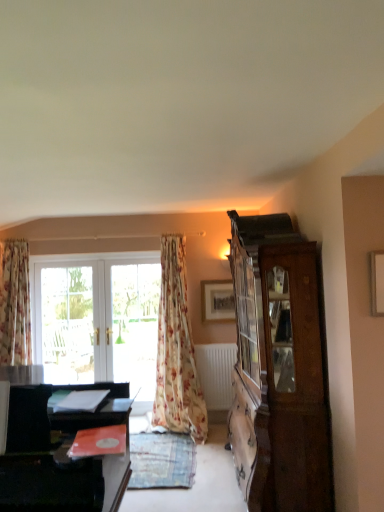
This screenshot has width=384, height=512. What do you see at coordinates (217, 301) in the screenshot? I see `wooden picture frame at upper center` at bounding box center [217, 301].

Measure the distance between point (310, 296) and camera.

The distance of point (310, 296) from camera is 8.84 feet.

This screenshot has height=512, width=384. What do you see at coordinates (54, 457) in the screenshot?
I see `black glossy desk at lower left` at bounding box center [54, 457].

Measure the distance between point (186, 381) and camera.

Point (186, 381) and camera are 15.04 feet apart.

Describe the element at coordinates (68, 321) in the screenshot. I see `clear glass window at center, marked as the first window in a left-to-right arrangement` at that location.

Where is `white glossy screen door at center`? The width and height of the screenshot is (384, 512). white glossy screen door at center is located at coordinates (135, 325).

Is white glass door at center, which is counted as the 1th window, starting from the right, wider than white glossy screen door at center?

Incorrect, the width of white glass door at center, which is counted as the 1th window, starting from the right, does not surpass that of white glossy screen door at center.

From the image's perspective, which is below, white glass door at center, which is counted as the 1th window, starting from the right, or white glossy screen door at center?

From the image's view, white glass door at center, which is counted as the 1th window, starting from the right, is below.

Is white glass door at center, which is the 2th window from left to right, in front of or behind white glossy screen door at center in the image?

white glass door at center, which is the 2th window from left to right, is positioned farther from the viewer than white glossy screen door at center.

Is white glossy screen door at center located within white glass door at center, which is counted as the 1th window, starting from the right?

Indeed, white glossy screen door at center is located within white glass door at center, which is counted as the 1th window, starting from the right.

Does floral fabric curtain at left, which is the 2th curtain from right to left, contain wooden cabinet at right?

No, wooden cabinet at right is not surrounded by floral fabric curtain at left, which is the 2th curtain from right to left.

Is floral fabric curtain at left, which is the 2th curtain from right to left, oriented towards wooden cabinet at right?

No, floral fabric curtain at left, which is the 2th curtain from right to left, is not aimed at wooden cabinet at right.

From a real-world perspective, between floral fabric curtain at left, which is the 2th curtain from right to left, and wooden cabinet at right, who is vertically lower?

From a 3D spatial view, wooden cabinet at right is below.

From the image's perspective, which one is positioned lower, white glass door at center, which is counted as the 1th window, starting from the right, or white matte radiator at lower center?

white matte radiator at lower center.

Can you tell me how much white glass door at center, which is counted as the 1th window, starting from the right, and white matte radiator at lower center differ in facing direction?

0.465 degrees separate the facing orientations of white glass door at center, which is counted as the 1th window, starting from the right, and white matte radiator at lower center.

Looking at the image, does white glass door at center, which is counted as the 1th window, starting from the right, seem bigger or smaller compared to white matte radiator at lower center?

Clearly, white glass door at center, which is counted as the 1th window, starting from the right, is larger in size than white matte radiator at lower center.

Consider the image. Is white glass door at center, which is the 2th window from left to right, wider or thinner than white matte radiator at lower center?

In the image, white glass door at center, which is the 2th window from left to right, appears to be more narrow than white matte radiator at lower center.

Who is more distant, white glossy screen door at center or floral fabric curtain at center, the second curtain from the left?

white glossy screen door at center is further from the camera.

Considering the sizes of objects white glossy screen door at center and floral fabric curtain at center, the first curtain viewed from the right, in the image provided, who is smaller, white glossy screen door at center or floral fabric curtain at center, the first curtain viewed from the right,?

white glossy screen door at center is smaller.

At what (x,y) coordinates should I click in order to perform the action: click on screen door on the left of the floral fabric curtain at center, the second curtain from the left. Please return your answer as a coordinate pair (x, y). The image size is (384, 512). Looking at the image, I should click on (135, 325).

Who is shorter, white glossy screen door at center or floral fabric curtain at center, the second curtain from the left?

Standing shorter between the two is white glossy screen door at center.

Does black glossy desk at lower left lie behind white glass door at center, which is counted as the 1th window, starting from the right?

No, black glossy desk at lower left is in front of white glass door at center, which is counted as the 1th window, starting from the right.

Is point (11, 388) closer or farther from the camera than point (150, 275)?

Clearly, point (11, 388) is closer to the camera than point (150, 275).

From a real-world perspective, is black glossy desk at lower left above or below white glass door at center, which is the 2th window from left to right?

In terms of real-world spatial position, black glossy desk at lower left is below white glass door at center, which is the 2th window from left to right.

Which is more to the left, black glossy desk at lower left or white glass door at center, which is counted as the 1th window, starting from the right?

white glass door at center, which is counted as the 1th window, starting from the right, is more to the left.

Which is closer, (x=125, y=338) or (x=9, y=311)?

The point (x=9, y=311) is closer to the camera.

Between white glossy screen door at center and floral fabric curtain at left, the first curtain positioned from the left, which one appears on the right side from the viewer's perspective?

Positioned to the right is white glossy screen door at center.

Does white glossy screen door at center come behind floral fabric curtain at left, the first curtain positioned from the left?

Yes, white glossy screen door at center is further from the camera.

From a real-world perspective, is white glossy screen door at center positioned above or below floral fabric curtain at left, the first curtain positioned from the left?

white glossy screen door at center is situated lower than floral fabric curtain at left, the first curtain positioned from the left, in the real world.

Is clear glass window at center, which appears as the 2th window when viewed from the right, completely or partially outside of floral fabric curtain at left, the first curtain positioned from the left?

That's correct, clear glass window at center, which appears as the 2th window when viewed from the right, is outside of floral fabric curtain at left, the first curtain positioned from the left.

From a real-world perspective, which object stands above the other?

floral fabric curtain at left, the first curtain positioned from the left, is physically above.

From the image's perspective, is clear glass window at center, marked as the first window in a left-to-right arrangement, on top of floral fabric curtain at left, the first curtain positioned from the left?

No, from the image's perspective, clear glass window at center, marked as the first window in a left-to-right arrangement, is not on top of floral fabric curtain at left, the first curtain positioned from the left.

From the white glossy screen door at center, count 2nd windows backward and point to it. Please provide its 2D coordinates.

[(96, 319)]

Where is `curtain above the wooden cabinet at right (from a real-world perspective)`? The height and width of the screenshot is (512, 384). curtain above the wooden cabinet at right (from a real-world perspective) is located at coordinates (15, 305).

When comparing their distances from black glossy desk at lower left, does white matte radiator at lower center or clear glass window at center, marked as the first window in a left-to-right arrangement, seem further?

The object further to black glossy desk at lower left is clear glass window at center, marked as the first window in a left-to-right arrangement.

When comparing their distances from floral fabric curtain at left, which is the 2th curtain from right to left, does wooden cabinet at right or white matte radiator at lower center seem closer?

white matte radiator at lower center is positioned closer to the anchor floral fabric curtain at left, which is the 2th curtain from right to left.

From the picture: Looking at the image, which one is located further to white matte radiator at lower center, wooden picture frame at upper center or white glossy screen door at center?

The object further to white matte radiator at lower center is white glossy screen door at center.

Considering their positions, is white matte radiator at lower center positioned closer to floral fabric curtain at center, the first curtain viewed from the right, than white glossy screen door at center?

white matte radiator at lower center lies closer to floral fabric curtain at center, the first curtain viewed from the right, than the other object.

Estimate the real-world distances between objects in this image. Which object is closer to clear glass window at center, marked as the first window in a left-to-right arrangement, black glossy desk at lower left or floral fabric curtain at center, the first curtain viewed from the right?

Based on the image, floral fabric curtain at center, the first curtain viewed from the right, appears to be nearer to clear glass window at center, marked as the first window in a left-to-right arrangement.

Considering their positions, is white matte radiator at lower center positioned further to floral fabric curtain at left, the first curtain positioned from the left, than floral fabric curtain at center, the second curtain from the left?

white matte radiator at lower center is further to floral fabric curtain at left, the first curtain positioned from the left.

Estimate the real-world distances between objects in this image. Which object is further from black glossy desk at lower left, white glass door at center, which is the 2th window from left to right, or clear glass window at center, which appears as the 2th window when viewed from the right?

clear glass window at center, which appears as the 2th window when viewed from the right, lies further to black glossy desk at lower left than the other object.

Looking at the image, which one is located closer to white matte radiator at lower center, floral fabric curtain at center, the second curtain from the left, or white glass door at center, which is counted as the 1th window, starting from the right?

floral fabric curtain at center, the second curtain from the left.

Where is `radiator located between wooden cabinet at right and white glossy screen door at center in the depth direction`? radiator located between wooden cabinet at right and white glossy screen door at center in the depth direction is located at coordinates (216, 373).

Locate an element on the screen. Image resolution: width=384 pixels, height=512 pixels. screen door between wooden cabinet at right and clear glass window at center, marked as the first window in a left-to-right arrangement, from front to back is located at coordinates (135, 325).

The image size is (384, 512). Find the location of `cabinetry between black glossy desk at lower left and wooden picture frame at upper center from front to back`. cabinetry between black glossy desk at lower left and wooden picture frame at upper center from front to back is located at coordinates (278, 369).

Find the location of `radiator between wooden cabinet at right and white glass door at center, which is the 2th window from left to right, from front to back`. radiator between wooden cabinet at right and white glass door at center, which is the 2th window from left to right, from front to back is located at coordinates (216, 373).